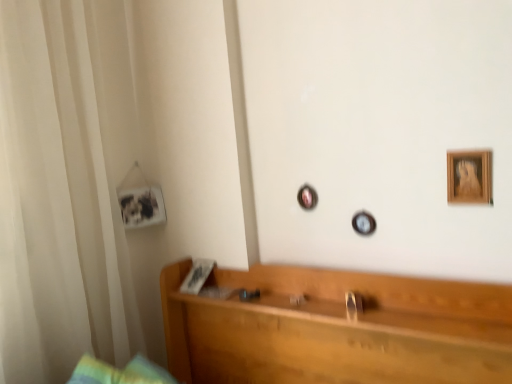
At what (x,y) coordinates should I click in order to perform the action: click on free spot above wooden headboard at center (from a real-world perspective). Please return your answer as a coordinate pair (x, y). Looking at the image, I should click on (352, 306).